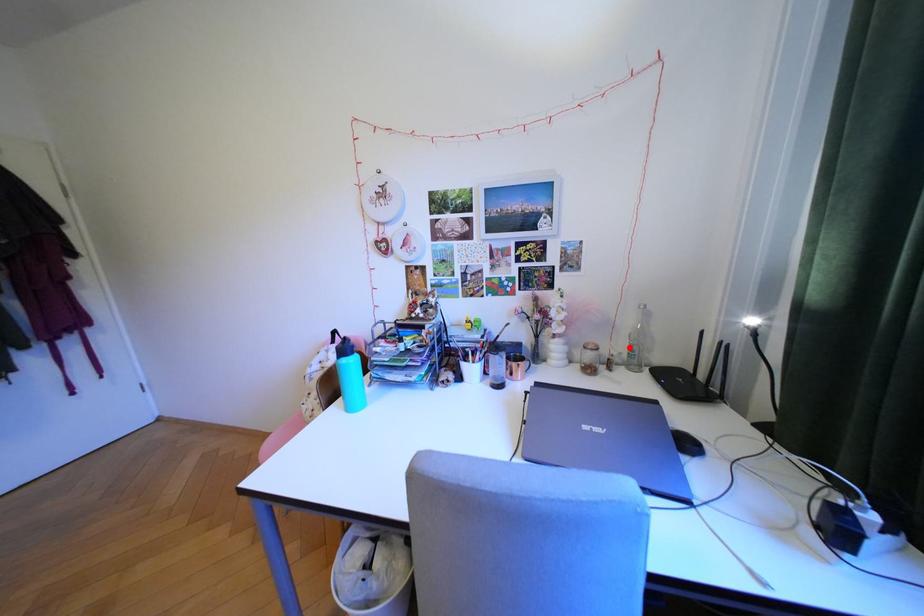
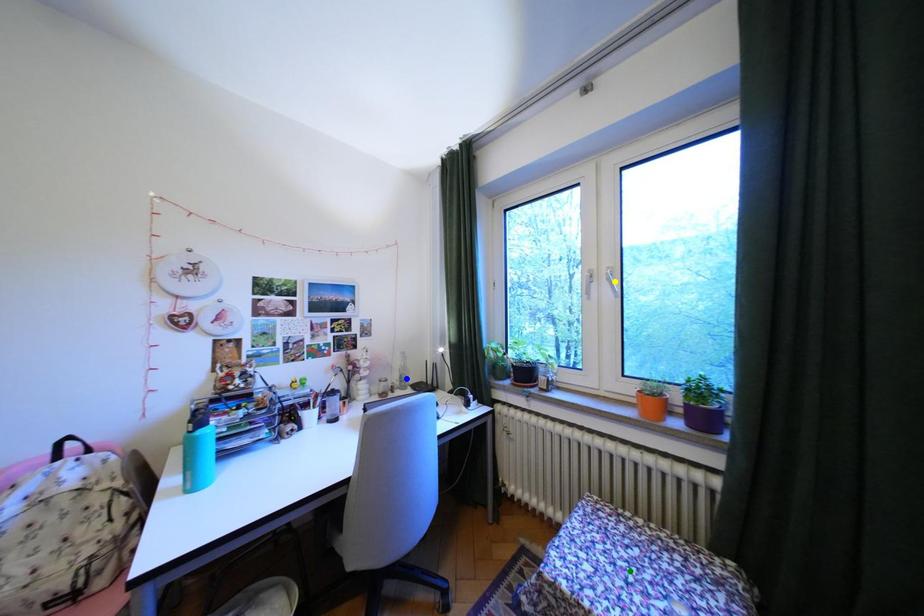
Question: I am providing you with two images of the same scene from different viewpoints. A red point is marked on the first image. You are given multiple points on the second image. Which point in image 2 represents the same 3d spot as the red point in image 1?

Choices:
 (A) green point
 (B) blue point
 (C) yellow point

Answer: (B)